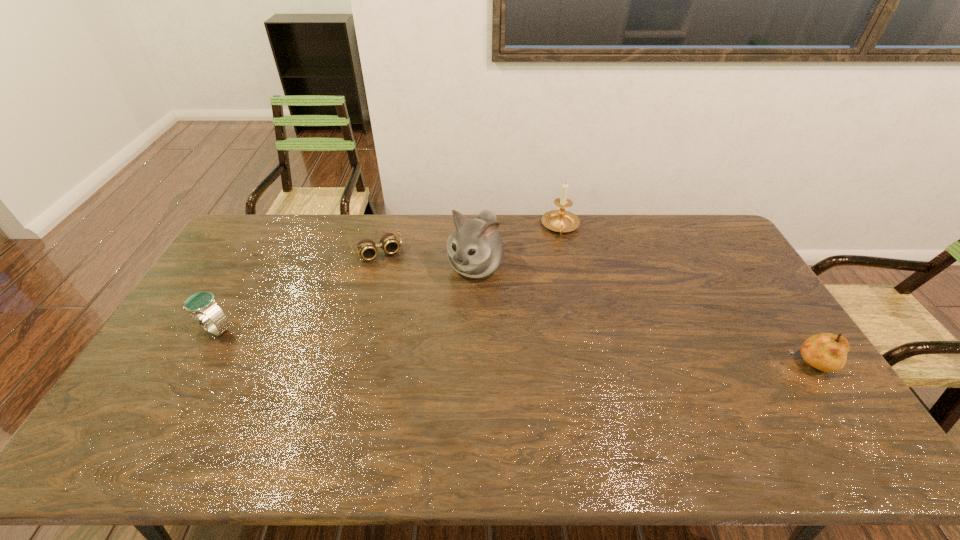
This screenshot has height=540, width=960. What are the coordinates of `vacant space located on the right of the watch` in the screenshot? It's located at (292, 329).

At what (x,y) coordinates should I click in order to perform the action: click on vacant space located on the left of the pear. Please return your answer as a coordinate pair (x, y). The height and width of the screenshot is (540, 960). Looking at the image, I should click on (641, 364).

At what (x,y) coordinates should I click in order to perform the action: click on vacant space located on the face of the tallest object. Please return your answer as a coordinate pair (x, y). The image size is (960, 540). Looking at the image, I should click on (435, 341).

Locate an element on the screen. free location located on the face of the tallest object is located at coordinates (450, 315).

At what (x,y) coordinates should I click in order to perform the action: click on vacant space situated 0.240m on the face of the tallest object. Please return your answer as a coordinate pair (x, y). Looking at the image, I should click on (434, 344).

This screenshot has width=960, height=540. Identify the location of vacant region located through the lenses of the shortest object. (395, 285).

Find the location of `free region located through the lenses of the shortest object`. free region located through the lenses of the shortest object is located at coordinates (415, 327).

Locate an element on the screen. Image resolution: width=960 pixels, height=540 pixels. vacant space located through the lenses of the shortest object is located at coordinates (412, 322).

This screenshot has width=960, height=540. I want to click on free location located with a handle on the side of the candle holder, so coord(565,266).

Locate an element on the screen. free space located 0.190m with a handle on the side of the candle holder is located at coordinates (566, 275).